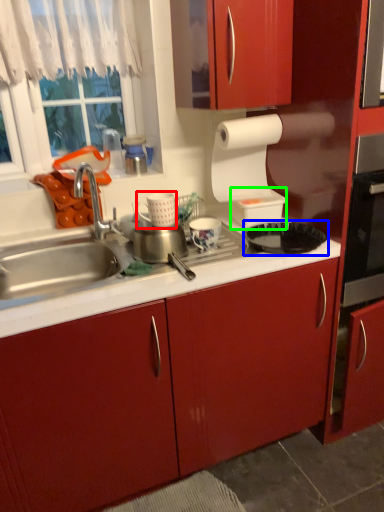
Question: Based on their relative distances, which object is farther from appliance (highlighted by a red box)? Choose from kitchen appliance (highlighted by a blue box) and appliance (highlighted by a green box).

Choices:
 (A) kitchen appliance
 (B) appliance

Answer: (B)